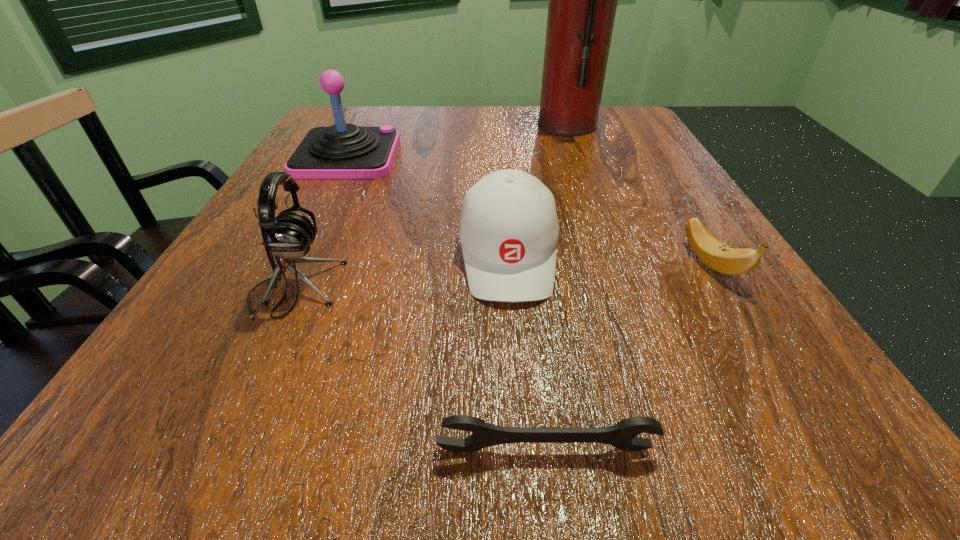
Identify the location of free space that satisfies the following two spatial constraints: 1. forward from the base of the joystick; 2. on the back side of the rightmost object. (293, 264).

In order to click on vacant space that satisfies the following two spatial constraints: 1. forward from the base of the joystick; 2. on the left side of the banana in this screenshot , I will do `click(293, 264)`.

Where is `free spot that satisfies the following two spatial constraints: 1. at the nozzle of the rightmost object; 2. on the left side of the fire extinguisher`? free spot that satisfies the following two spatial constraints: 1. at the nozzle of the rightmost object; 2. on the left side of the fire extinguisher is located at coordinates (620, 264).

This screenshot has height=540, width=960. What are the coordinates of `blank space that satisfies the following two spatial constraints: 1. at the nozzle of the tallest object; 2. on the back side of the banana` in the screenshot? It's located at (620, 264).